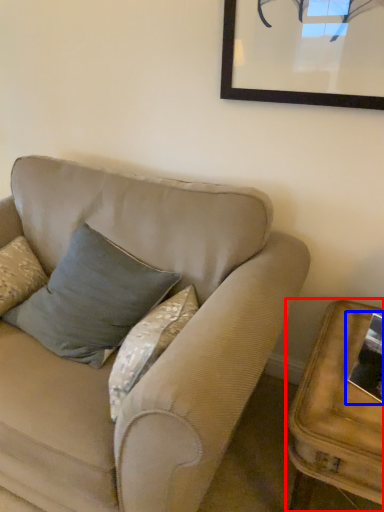
Question: Among these objects, which one is nearest to the camera, table (highlighted by a red box) or picture frame (highlighted by a blue box)?

Choices:
 (A) table
 (B) picture frame

Answer: (A)